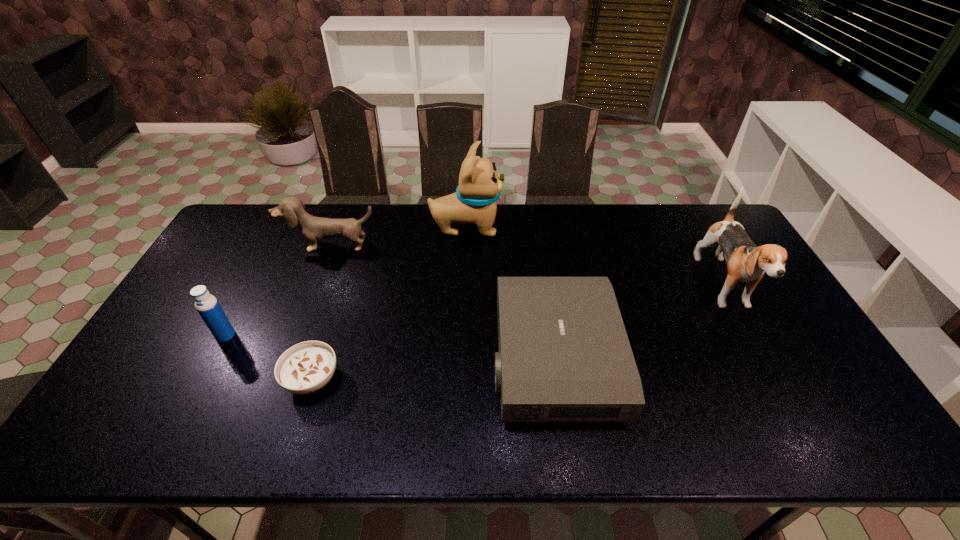
You are a GUI agent. You are given a task and a screenshot of the screen. Output one action in this format:
    pyautogui.click(x=<x>, y=<y>)
    Task: Click on the second puppy from left to right
    
    Given the screenshot: What is the action you would take?
    pyautogui.click(x=474, y=201)

Find the location of a particular element. the rightmost puppy is located at coordinates (746, 262).

The image size is (960, 540). I want to click on the shortest puppy, so click(x=314, y=229).

Identify the location of water bottle. The image size is (960, 540). (206, 304).

Find the location of a particular element. Image resolution: width=960 pixels, height=540 pixels. projector is located at coordinates (564, 355).

Identify the location of the shortest object. (306, 367).

I want to click on free space located on the face of the second puppy from left to right, so click(x=569, y=227).

Identify the location of vacant area situated at the face of the rightmost puppy. The width and height of the screenshot is (960, 540). (780, 389).

You are a GUI agent. You are given a task and a screenshot of the screen. Output one action in this format:
    pyautogui.click(x=<x>, y=<y>)
    Task: Click on the vacant region located 0.300m at the face of the shortest puppy
    
    Given the screenshot: What is the action you would take?
    pyautogui.click(x=300, y=323)

This screenshot has height=540, width=960. I want to click on vacant area situated on the back of the water bottle, so click(269, 253).